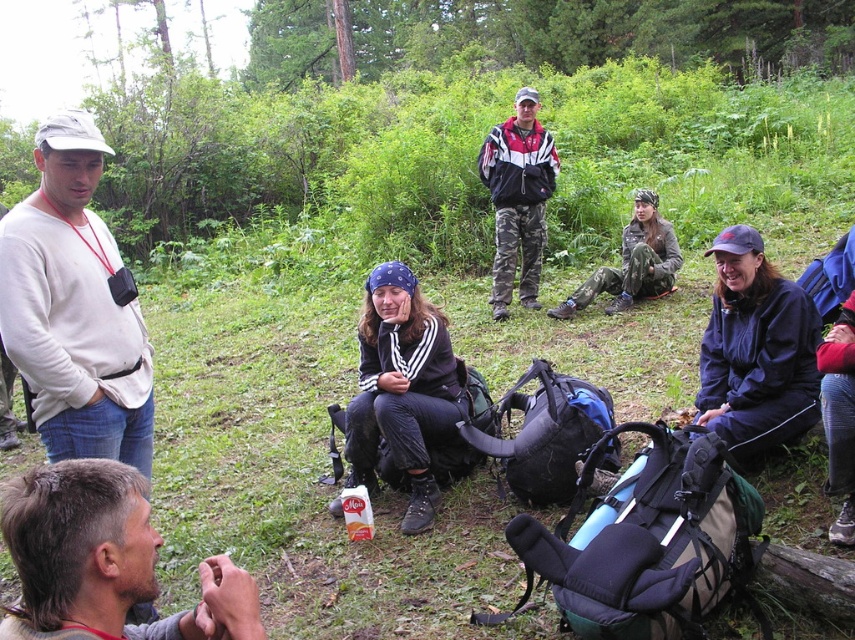
Question: Among these points, which one is farthest from the camera?

Choices:
 (A) (15, 563)
 (B) (528, 209)

Answer: (B)

Question: Can you confirm if white matte shirt at left is positioned above camouflage pants at center?

Choices:
 (A) no
 (B) yes

Answer: (A)

Question: Is white matte shirt at left to the left of camouflage pants at center from the viewer's perspective?

Choices:
 (A) yes
 (B) no

Answer: (A)

Question: Which of the following is the farthest from the observer?

Choices:
 (A) camouflage pants at center
 (B) brown hair at lower left

Answer: (A)

Question: Is white matte shirt at left closer to camera compared to camouflage pants at center?

Choices:
 (A) no
 (B) yes

Answer: (B)

Question: Which object appears closest to the camera in this image?

Choices:
 (A) white matte shirt at left
 (B) camouflage pants at center

Answer: (A)